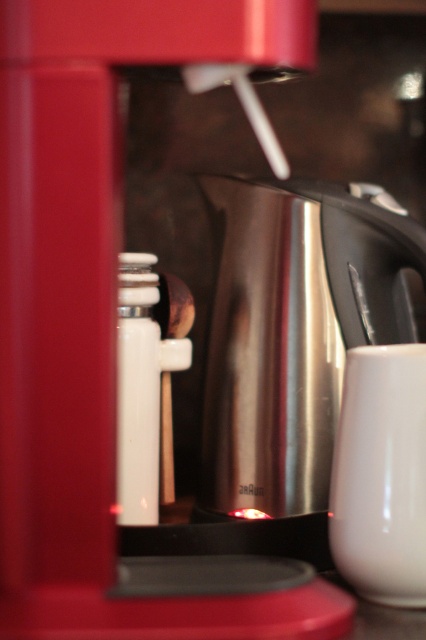
You are preparing to pour coffee from the stainless steel coffee pot at center into the white glossy mug at lower right. Will the mug overflow if you fill it completely from the pot?

The stainless steel coffee pot at center is wider than the white glossy mug at lower right. However, the question of overflow depends on the volume of both items, not just width. Since the description only mentions width, we cannot definitively determine if the mug will overflow based on the provided information.

You are a barista preparing coffee. You need to pour hot coffee from the stainless steel coffee pot at center into the white glossy mug at lower right. Will the mug overflow if you fill it completely?

The stainless steel coffee pot at center is much taller than the white glossy mug at lower right, but this does not necessarily indicate the capacity. The mug could still overflow if filled to its brim, so pour carefully.

You are a barista preparing coffee and need to pour hot water from the stainless steel coffee pot at center into the white glossy mug at lower right. Is the pot positioned in a way that allows you to pour the water easily without moving the mug?

The stainless steel coffee pot at center is further to the viewer than the white glossy mug at lower right, so the pot is positioned higher and closer to you, making it easy to pour water into the mug without needing to move it.